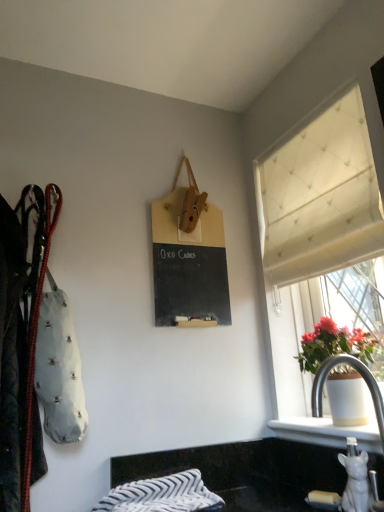
This screenshot has width=384, height=512. What do you see at coordinates (314, 223) in the screenshot? I see `white textured curtain at upper right` at bounding box center [314, 223].

The width and height of the screenshot is (384, 512). What are the coordinates of `white textured curtain at upper right` in the screenshot? It's located at (314, 223).

Measure the distance between white glossy sink at lower right and camera.

Answer: They are 1.02 meters apart.

You are a GUI agent. You are given a task and a screenshot of the screen. Output one action in this format:
    pyautogui.click(x=<x>, y=<y>)
    Task: Click on the black granite countertop at lower center
    The image size is (384, 512).
    Given the screenshot: What is the action you would take?
    point(245,471)

Locate an element on the screen. This screenshot has height=512, width=384. leather coat at left is located at coordinates (21, 347).

This screenshot has width=384, height=512. In order to click on white ceramic pot at right in this screenshot , I will do `click(333, 345)`.

Where is `white textured curtain at upper right`? white textured curtain at upper right is located at coordinates (314, 223).

From the image's perspective, is white glossy sink at lower right located above or below white textured curtain at upper right?

Based on their image positions, white glossy sink at lower right is located beneath white textured curtain at upper right.

From a real-world perspective, is white glossy sink at lower right positioned above or below white textured curtain at upper right?

white glossy sink at lower right is situated lower than white textured curtain at upper right in the real world.

Does white glossy sink at lower right appear on the right side of white textured curtain at upper right?

No, white glossy sink at lower right is not to the right of white textured curtain at upper right.

How different are the orientations of white glossy sink at lower right and white textured curtain at upper right in degrees?

The angular difference between white glossy sink at lower right and white textured curtain at upper right is 0.774 degrees.

Is white ceramic pot at right taller than striped cotton blanket at lower center?

Yes.

From the image's perspective, which object appears higher, white ceramic pot at right or striped cotton blanket at lower center?

white ceramic pot at right, from the image's perspective.

Is white ceramic pot at right completely or partially outside of striped cotton blanket at lower center?

white ceramic pot at right is positioned outside striped cotton blanket at lower center.

Considering the positions of objects white ceramic pot at right and striped cotton blanket at lower center in the image provided, who is behind, white ceramic pot at right or striped cotton blanket at lower center?

white ceramic pot at right is further away from the camera.

Is white ceramic pot at right turned away from black granite countertop at lower center?

No, black granite countertop at lower center is not at the back of white ceramic pot at right.

Consider the image. Considering the positions of objects white ceramic pot at right and black granite countertop at lower center in the image provided, who is more to the left, white ceramic pot at right or black granite countertop at lower center?

black granite countertop at lower center.

From the image's perspective, is white ceramic pot at right located beneath black granite countertop at lower center?

Incorrect, from the image's perspective, white ceramic pot at right is higher than black granite countertop at lower center.

Does leather coat at left turn towards striped cotton blanket at lower center?

No, leather coat at left does not turn towards striped cotton blanket at lower center.

Consider the image. Are leather coat at left and striped cotton blanket at lower center beside each other?

No, leather coat at left is not with striped cotton blanket at lower center.

This screenshot has width=384, height=512. I want to click on closet in front of the striped cotton blanket at lower center, so click(x=21, y=347).

Does white glossy sink at lower right touch white ceramic pot at right?

No.

Is white glossy sink at lower right positioned behind white ceramic pot at right?

No, white glossy sink at lower right is in front of white ceramic pot at right.

Is white glossy sink at lower right situated inside white ceramic pot at right or outside?

white glossy sink at lower right is not enclosed by white ceramic pot at right.

From the image's perspective, who appears lower, striped cotton blanket at lower center or white ceramic pot at right?

striped cotton blanket at lower center.

Is striped cotton blanket at lower center surrounding white ceramic pot at right?

No.

Who is shorter, striped cotton blanket at lower center or white ceramic pot at right?

striped cotton blanket at lower center.

Is striped cotton blanket at lower center to the right of white ceramic pot at right from the viewer's perspective?

Incorrect, striped cotton blanket at lower center is not on the right side of white ceramic pot at right.

Is black chalkboard at upper center outside of white ceramic pot at right?

Indeed, black chalkboard at upper center is completely outside white ceramic pot at right.

What's the angular difference between black chalkboard at upper center and white ceramic pot at right's facing directions?

They differ by 90.7 degrees in their facing directions.

Is point (191, 274) positioned after point (351, 415)?

Yes, it is behind point (351, 415).

Is black chalkboard at upper center to the left of white ceramic pot at right from the viewer's perspective?

Yes.

Locate an element on the screen. The image size is (384, 512). window above the white glossy sink at lower right (from a real-world perspective) is located at coordinates point(314,223).

I want to click on houseplant behind the striped cotton blanket at lower center, so [x=333, y=345].

Looking at this image, considering their positions, is white textured curtain at upper right positioned further to black granite countertop at lower center than white glossy sink at lower right?

Among the two, white textured curtain at upper right is located further to black granite countertop at lower center.

Estimate the real-world distances between objects in this image. Which object is further from black chalkboard at upper center, white textured curtain at upper right or black granite countertop at lower center?

Based on the image, black granite countertop at lower center appears to be further to black chalkboard at upper center.

When comparing their distances from white ceramic pot at right, does white glossy sink at lower right or white textured curtain at upper right seem closer?

The object closer to white ceramic pot at right is white glossy sink at lower right.

In the scene shown: Looking at the image, which one is located closer to black granite countertop at lower center, striped cotton blanket at lower center or white textured curtain at upper right?

Among the two, striped cotton blanket at lower center is located nearer to black granite countertop at lower center.

Consider the image. Based on their spatial positions, is striped cotton blanket at lower center or leather coat at left further from black chalkboard at upper center?

Based on the image, striped cotton blanket at lower center appears to be further to black chalkboard at upper center.

From the image, which object appears to be farther from white ceramic pot at right, leather coat at left or black chalkboard at upper center?

leather coat at left is positioned further to the anchor white ceramic pot at right.

From the image, which object appears to be farther from white glossy sink at lower right, black chalkboard at upper center or striped cotton blanket at lower center?

black chalkboard at upper center lies further to white glossy sink at lower right than the other object.

Estimate the real-world distances between objects in this image. Which object is further from leather coat at left, black chalkboard at upper center or white glossy sink at lower right?

white glossy sink at lower right is further to leather coat at left.

In order to click on counter top between black chalkboard at upper center and striped cotton blanket at lower center from top to bottom in this screenshot , I will do tap(245, 471).

The height and width of the screenshot is (512, 384). What are the coordinates of `counter top between leather coat at left and white glossy sink at lower right from left to right` in the screenshot? It's located at (245, 471).

Locate an element on the screen. This screenshot has height=512, width=384. counter top between leather coat at left and striped cotton blanket at lower center from top to bottom is located at coordinates (245, 471).

Find the location of a particular element. This screenshot has height=512, width=384. bulletin board located between leather coat at left and white textured curtain at upper right in the left-right direction is located at coordinates (189, 266).